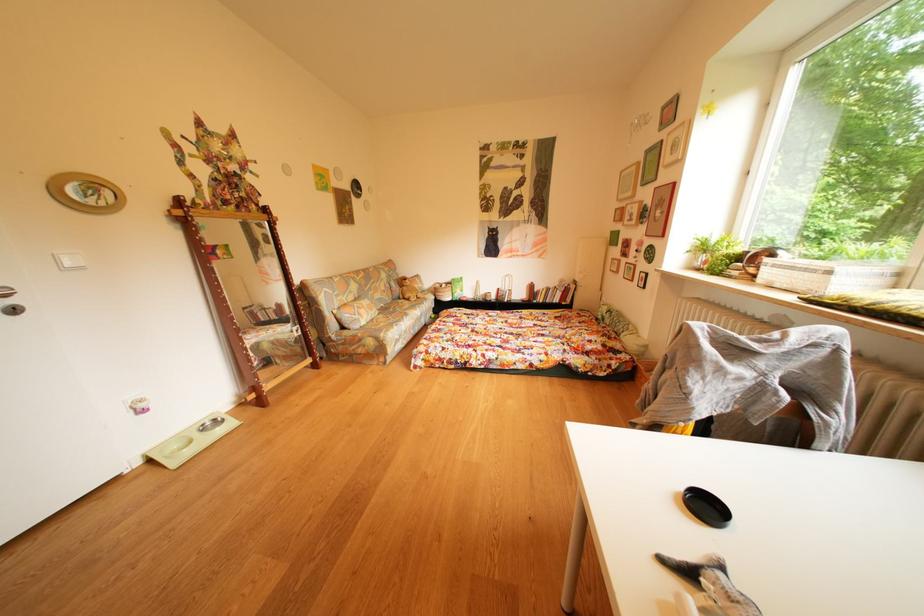
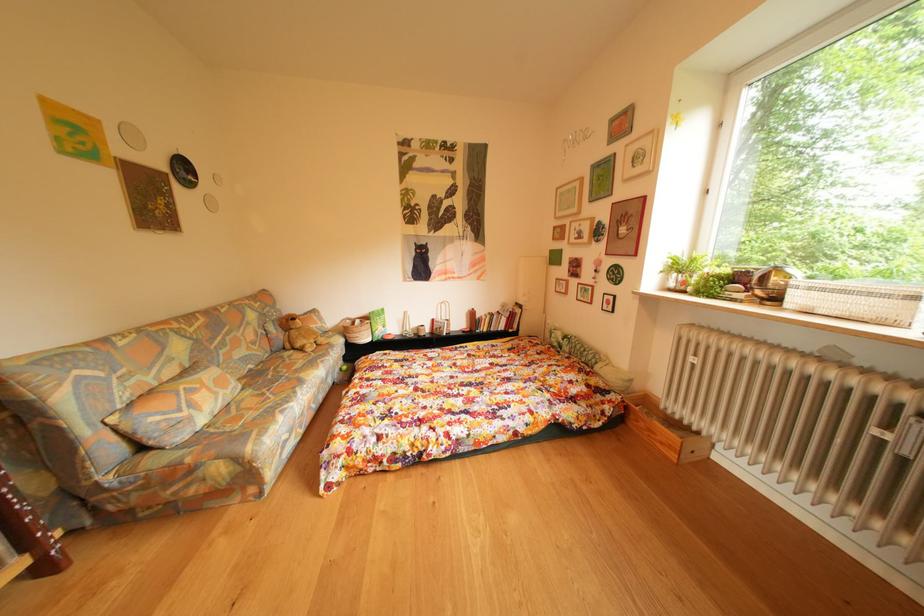
Question: Which direction would the cameraman need to move to produce the second image? Reply with the corresponding letter.

Choices:
 (A) Left
 (B) Right
 (C) Forward
 (D) Backward

Answer: (C)